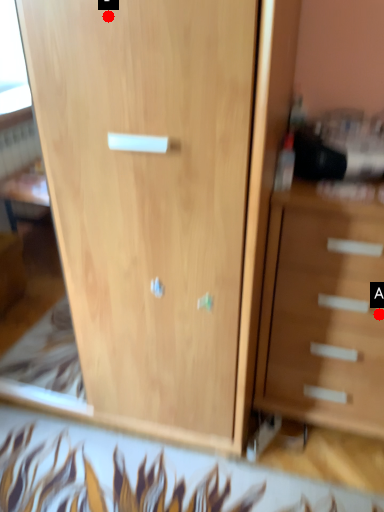
Question: Two points are circled on the image, labeled by A and B beside each circle. Which point is closer to the camera?

Choices:
 (A) A is closer
 (B) B is closer

Answer: (B)